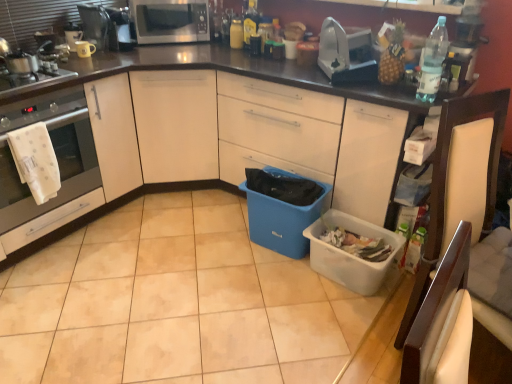
I want to click on vacant area on top of metallic silver coffee maker at upper left, which is the 2th appliance from right to left (from a real-world perspective), so click(105, 3).